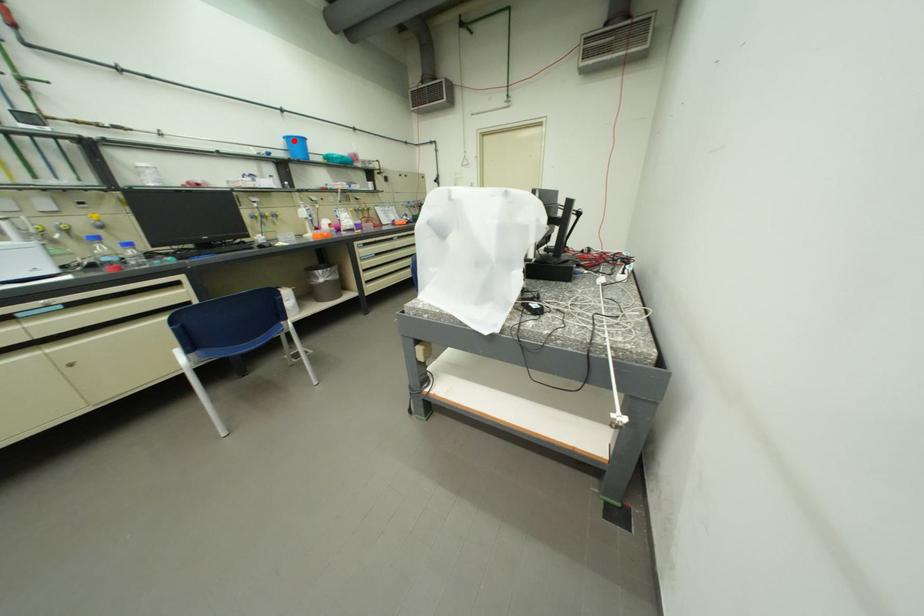
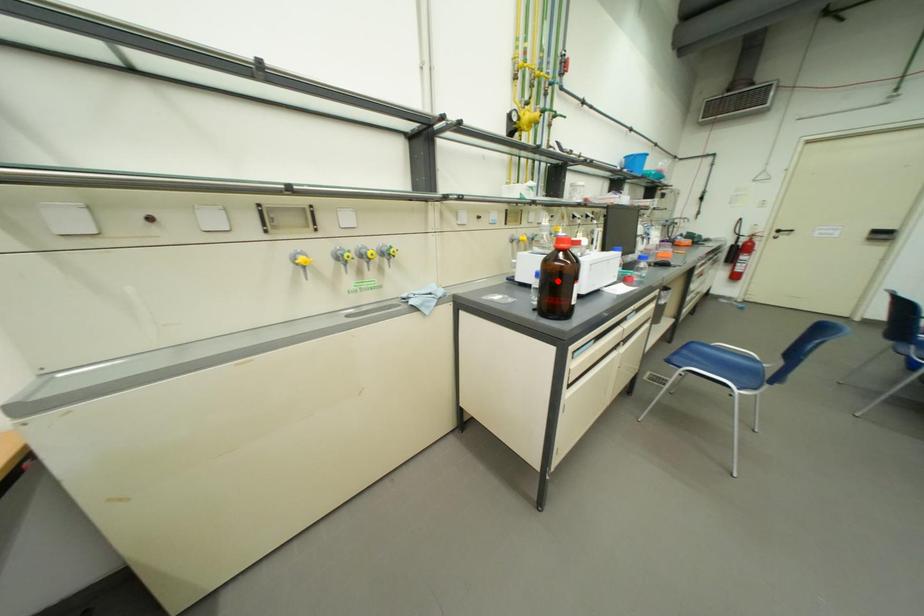
I am providing you with two images of the same scene from different viewpoints. A red point is marked on the first image and another point is marked on the second image. Is the marked point in image1 the same physical position as the marked point in image2?

No